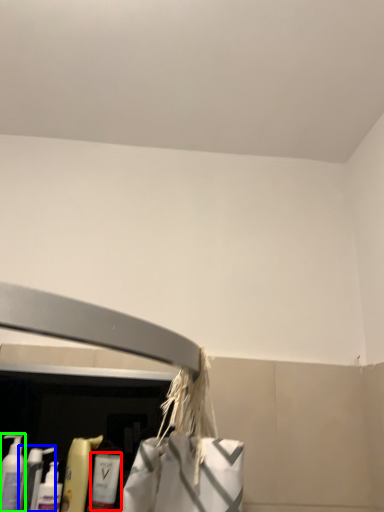
Question: Considering the real-world distances, which object is farthest from cleaning product (highlighted by a red box)? cleaning product (highlighted by a blue box) or cleaning product (highlighted by a green box)?

Choices:
 (A) cleaning product
 (B) cleaning product

Answer: (B)